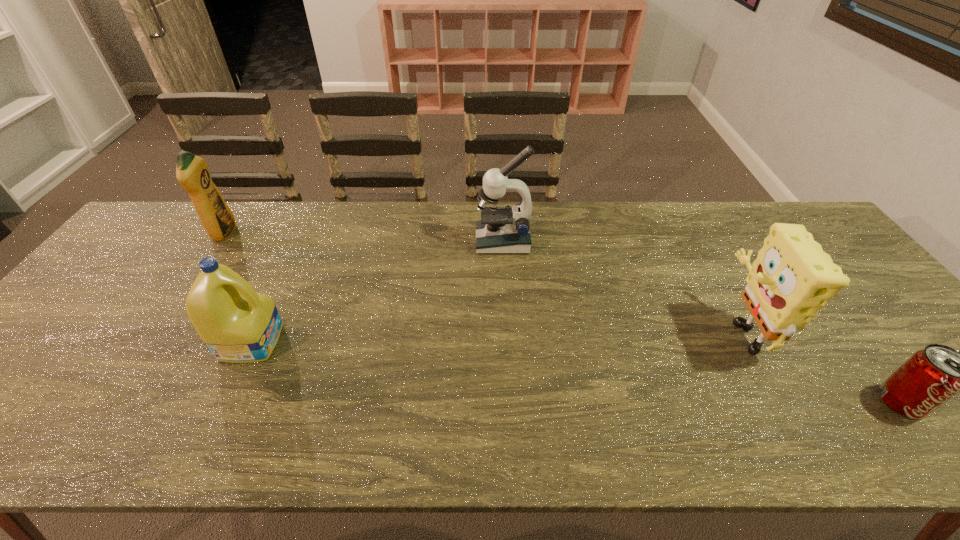
Locate an element on the screen. This screenshot has width=960, height=540. free space that satisfies the following two spatial constraints: 1. on the label of the rightmost object; 2. on the left side of the second object from left to right is located at coordinates (224, 402).

The width and height of the screenshot is (960, 540). I want to click on free space in the image that satisfies the following two spatial constraints: 1. on the label of the nearer detergent; 2. on the left side of the shortest object, so click(x=224, y=402).